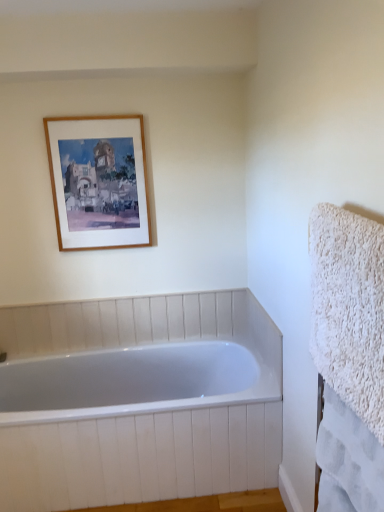
Question: Does point (135, 488) appear closer or farther from the camera than point (329, 269)?

Choices:
 (A) farther
 (B) closer

Answer: (A)

Question: Do you think white glossy bathtub at center is within white fluffy towel at right, the second bath towel positioned from the bottom, or outside of it?

Choices:
 (A) inside
 (B) outside

Answer: (B)

Question: Which object is positioned closest to the wooden frame at upper left?

Choices:
 (A) white fluffy towel at right, the second bath towel positioned from the bottom
 (B) white glossy bathtub at center
 (C) white fluffy towel at right, marked as the 1th bath towel in a bottom-to-top arrangement

Answer: (B)

Question: Estimate the real-world distances between objects in this image. Which object is closer to the wooden frame at upper left?

Choices:
 (A) white fluffy towel at right, the second bath towel when ordered from top to bottom
 (B) white fluffy towel at right, the second bath towel positioned from the bottom
 (C) white glossy bathtub at center

Answer: (C)